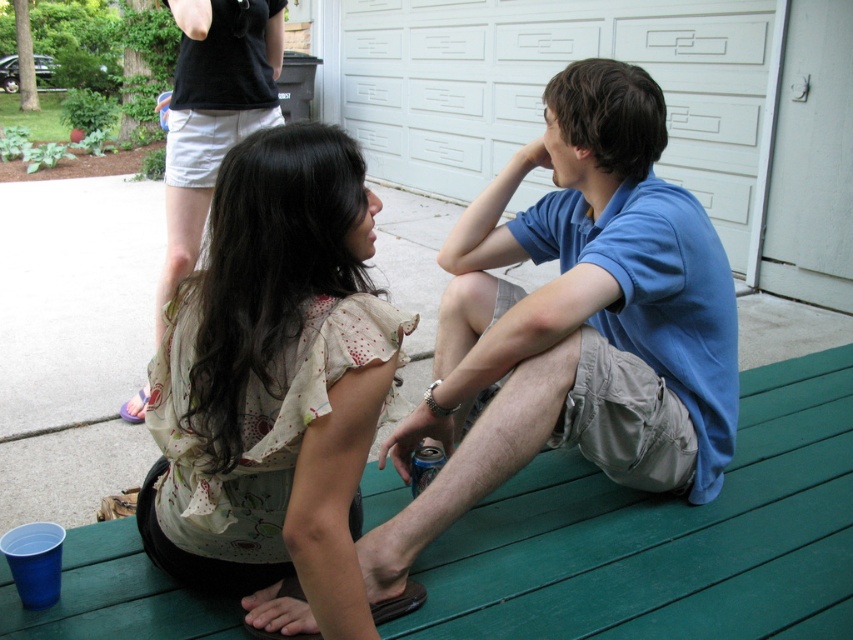
Can you confirm if blue cotton shirt at center is wider than floral cotton blouse at center?

Indeed, blue cotton shirt at center has a greater width compared to floral cotton blouse at center.

Who is lower down, blue cotton shirt at center or floral cotton blouse at center?

blue cotton shirt at center

I want to click on blue cotton shirt at center, so click(x=573, y=324).

Where is `blue cotton shirt at center`? This screenshot has height=640, width=853. blue cotton shirt at center is located at coordinates (573, 324).

Which is in front, point (564, 330) or point (508, 109)?

Point (564, 330)

What do you see at coordinates (573, 324) in the screenshot? The image size is (853, 640). I see `blue cotton shirt at center` at bounding box center [573, 324].

Locate an element on the screen. The image size is (853, 640). blue cotton shirt at center is located at coordinates (573, 324).

Between floral cotton blouse at center and white textured garage door at upper center, which one has more height?

Standing taller between the two is white textured garage door at upper center.

Which is in front, point (325, 189) or point (721, 230)?

Point (325, 189)

The width and height of the screenshot is (853, 640). I want to click on floral cotton blouse at center, so click(273, 381).